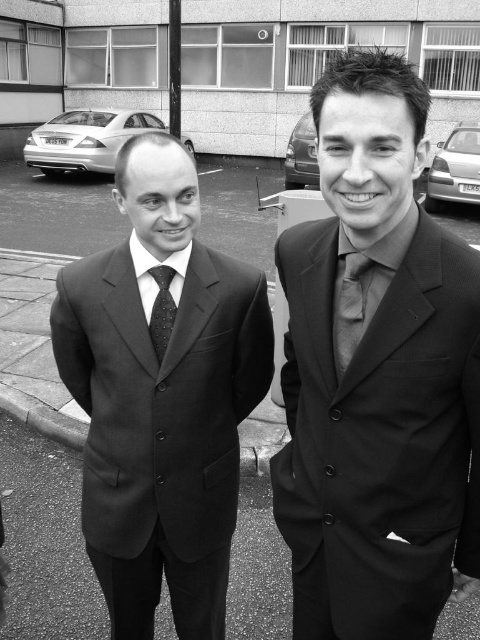
Question: Which object appears farthest from the camera in this image?

Choices:
 (A) black smooth suit at center
 (B) black satin suit at right
 (C) black dotted tie at center
 (D) matte gray tie at center

Answer: (C)

Question: Is black satin suit at right positioned behind matte gray tie at center?

Choices:
 (A) yes
 (B) no

Answer: (B)

Question: Is black smooth suit at center below black dotted tie at center?

Choices:
 (A) no
 (B) yes

Answer: (B)

Question: Which object is positioned farthest from the black satin suit at right?

Choices:
 (A) matte gray tie at center
 (B) black smooth suit at center
 (C) black dotted tie at center

Answer: (C)

Question: From the image, what is the correct spatial relationship of black satin suit at right in relation to black smooth suit at center?

Choices:
 (A) left
 (B) right

Answer: (B)

Question: Estimate the real-world distances between objects in this image. Which object is farther from the matte gray tie at center?

Choices:
 (A) black smooth suit at center
 (B) black dotted tie at center

Answer: (A)